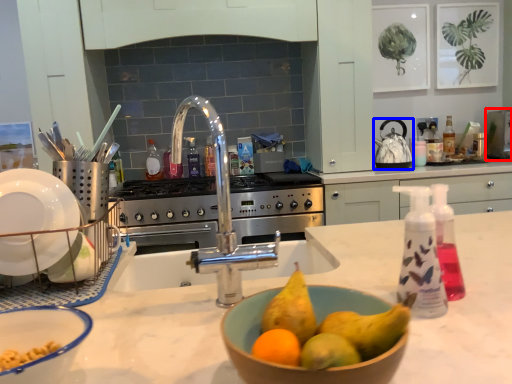
Question: Which object is closer to the camera taking this photo, appliance (highlighted by a red box) or kitchen appliance (highlighted by a blue box)?

Choices:
 (A) appliance
 (B) kitchen appliance

Answer: (B)